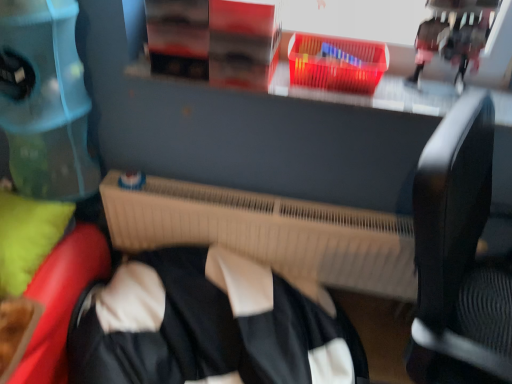
Question: Does point (293, 67) appear closer or farther from the camera than point (46, 241)?

Choices:
 (A) farther
 (B) closer

Answer: (B)

Question: Is translucent plastic basket at upper center inside the boundaries of green fabric pillow at lower left, or outside?

Choices:
 (A) inside
 (B) outside

Answer: (B)

Question: Which of these objects is positioned closest to the translucent plastic basket at upper center?

Choices:
 (A) beige plastic radiator at center
 (B) green fabric pillow at lower left
 (C) black matte jacket at center

Answer: (A)

Question: Considering the real-world distances, which object is farthest from the black matte jacket at center?

Choices:
 (A) translucent plastic basket at upper center
 (B) green fabric pillow at lower left
 (C) beige plastic radiator at center

Answer: (A)